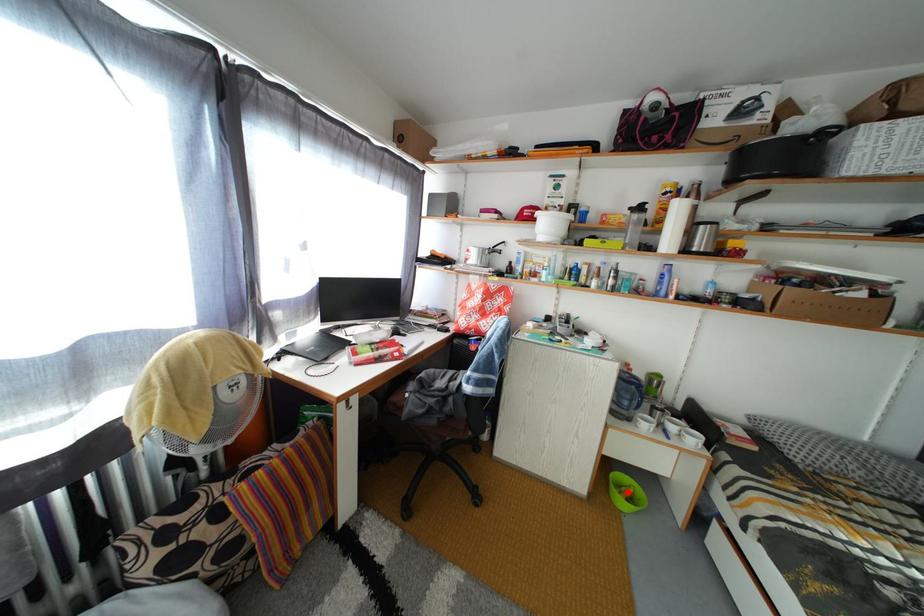
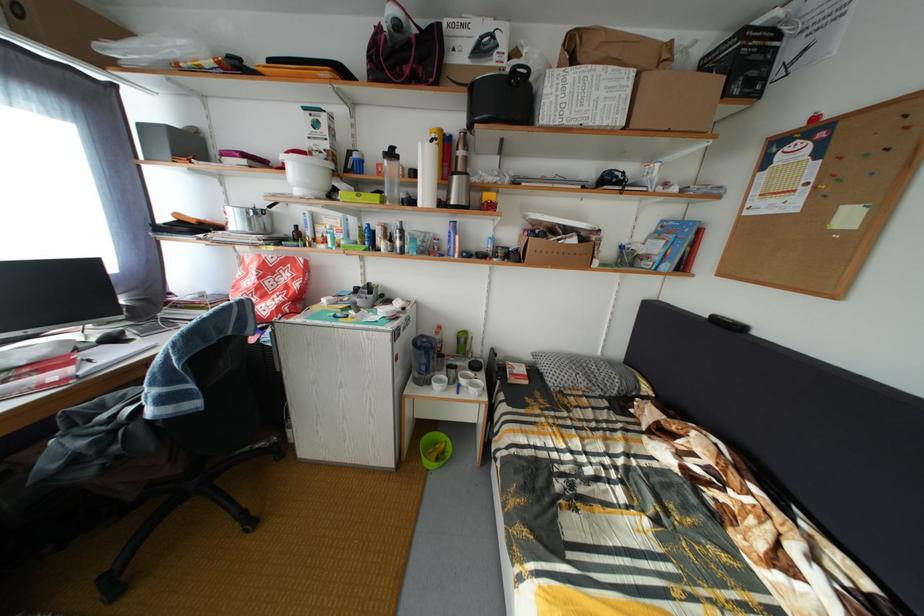
Where in the second image is the point corresponding to the highlighted location from the first image?

(444, 451)